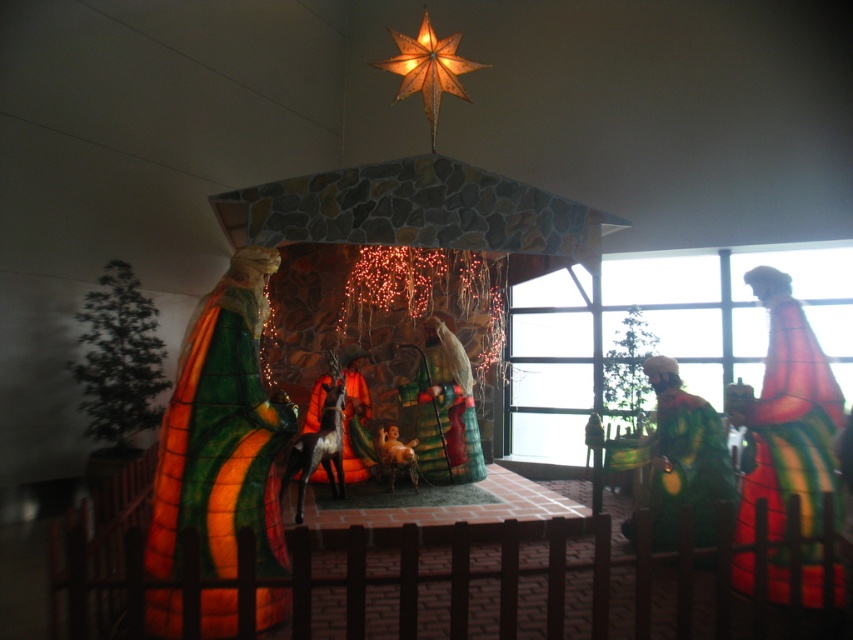
You are a GUI agent. You are given a task and a screenshot of the screen. Output one action in this format:
    pyautogui.click(x=<x>, y=<y>)
    Task: Click on the green textured robe at right
    
    Given the screenshot: What is the action you would take?
    (x=683, y=458)

From the picture: Who is taller, shiny green fabric at center or matte orange robe at center?

With more height is shiny green fabric at center.

Looking at this image, does shiny green fabric at center appear on the left side of matte orange robe at center?

In fact, shiny green fabric at center is to the right of matte orange robe at center.

Is point (428, 410) farther from viewer compared to point (349, 458)?

Yes, it is behind point (349, 458).

Image resolution: width=853 pixels, height=640 pixels. Find the location of `shiny green fabric at center`. shiny green fabric at center is located at coordinates (444, 410).

Can you confirm if matte green fabric figure at center is taller than green textured robe at right?

Indeed, matte green fabric figure at center has a greater height compared to green textured robe at right.

Between point (793, 337) and point (698, 476), which one is positioned behind?

Positioned behind is point (698, 476).

Is point (805, 413) closer to viewer compared to point (695, 508)?

Yes, point (805, 413) is in front of point (695, 508).

Where is `matte green fabric figure at center`? matte green fabric figure at center is located at coordinates (788, 417).